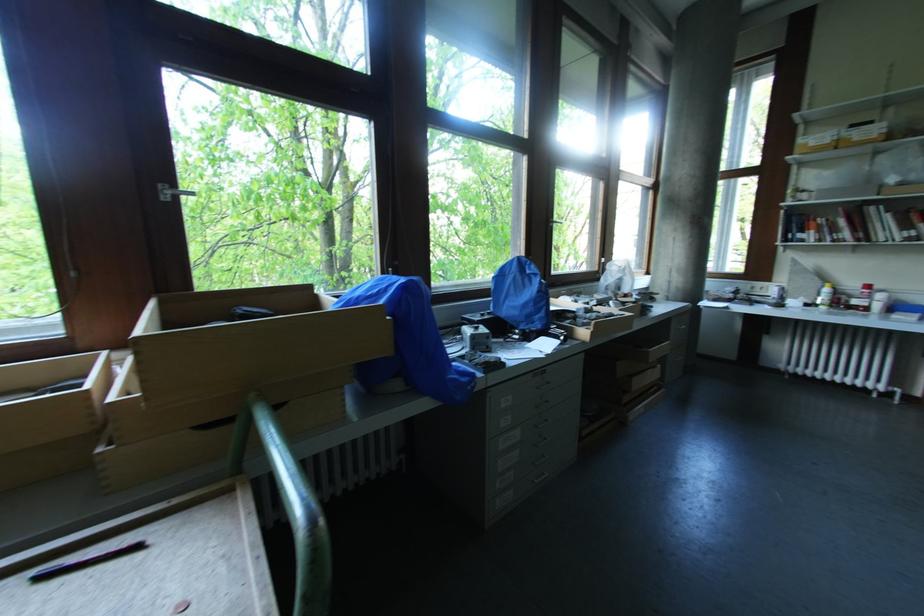
I want to click on white bottle, so click(x=880, y=302).